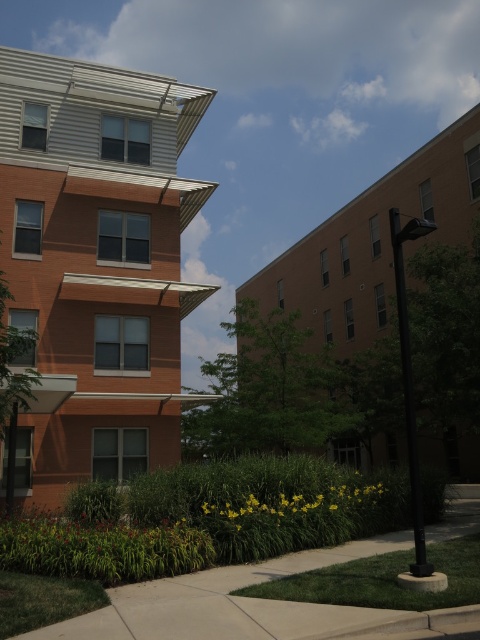
Question: Is orange brick building at left behind concrete sidewalk at lower center?

Choices:
 (A) no
 (B) yes

Answer: (B)

Question: Is orange brick building at left to the left of concrete sidewalk at lower center from the viewer's perspective?

Choices:
 (A) yes
 (B) no

Answer: (A)

Question: Which object is farther from the camera taking this photo?

Choices:
 (A) orange brick building at left
 (B) concrete sidewalk at lower center

Answer: (A)

Question: In this image, where is orange brick building at left located relative to concrete sidewalk at lower center?

Choices:
 (A) right
 (B) left

Answer: (B)

Question: Among these objects, which one is farthest from the camera?

Choices:
 (A) orange brick building at left
 (B) concrete sidewalk at lower center

Answer: (A)